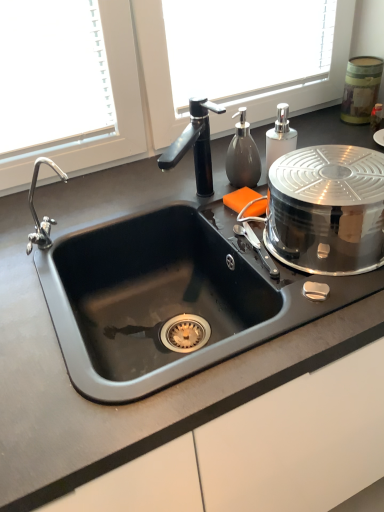
Where is `blank space to the left of metallic canister at upper right, placed as the 2th appliance when sorted from left to right`? blank space to the left of metallic canister at upper right, placed as the 2th appliance when sorted from left to right is located at coordinates (317, 129).